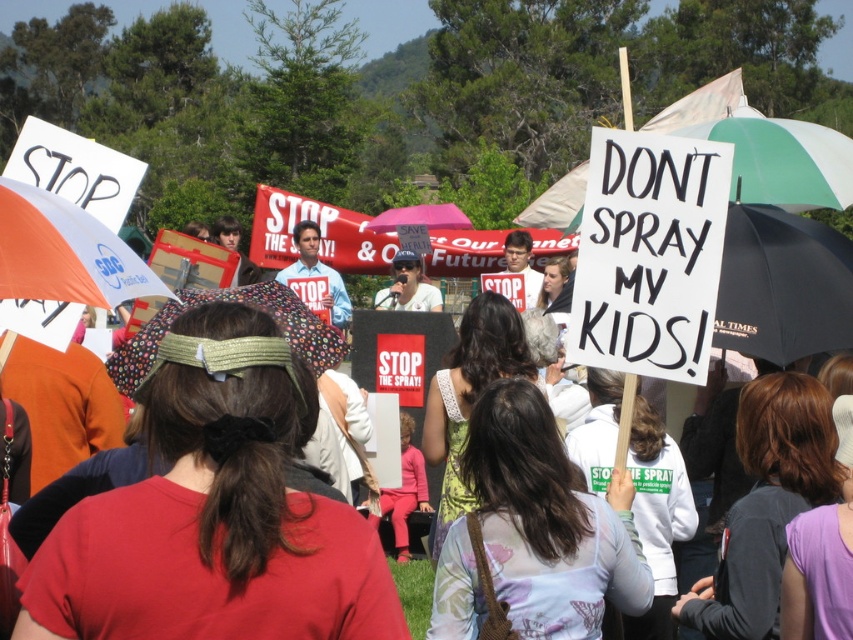
You are a photographer at the protest and want to capture a photo that includes both the orange fabric umbrella at upper left and the floral fabric umbrella at center. Which umbrella should you position closer to the front of the image to ensure both are visible?

To ensure both the orange fabric umbrella at upper left and the floral fabric umbrella at center are visible, position the floral fabric umbrella at center closer to the front since the orange fabric umbrella at upper left is located above it and might block the view if it is in front.

You are a photographer at the protest. You want to capture a photo that includes both the orange fabric umbrella at upper left and the floral fabric umbrella at center. Which umbrella should you adjust your camera angle to focus on first to ensure both are visible in the frame?

The orange fabric umbrella at upper left is in front of the floral fabric umbrella at center, so you should focus on the orange fabric umbrella at upper left first to ensure both are visible in the frame.

You are standing at the speaker podium in the center of the protest. You notice two points in the crowd where people are holding signs. One is at point (131, 298) and the other at point (292, 324). Which point is closer to you?

Point (131, 298) is in front of point (292, 324), so the sign at point (131, 298) is closer to you.